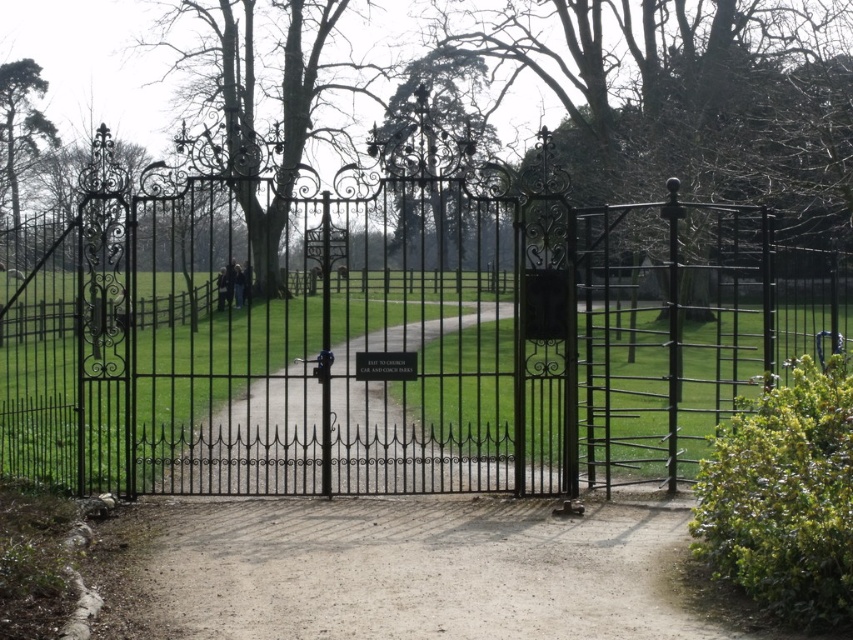
Question: Among these objects, which one is farthest from the camera?

Choices:
 (A) dirt/gravel path at center
 (B) black wrought iron gate at center

Answer: (B)

Question: Is black wrought iron gate at center wider than dirt/gravel path at center?

Choices:
 (A) yes
 (B) no

Answer: (A)

Question: Considering the relative positions of black wrought iron gate at center and dirt/gravel path at center in the image provided, where is black wrought iron gate at center located with respect to dirt/gravel path at center?

Choices:
 (A) right
 (B) left

Answer: (A)

Question: Which of the following is the farthest from the observer?

Choices:
 (A) (460, 509)
 (B) (1, 321)

Answer: (B)

Question: Observing the image, what is the correct spatial positioning of black wrought iron gate at center in reference to dirt/gravel path at center?

Choices:
 (A) above
 (B) below

Answer: (A)